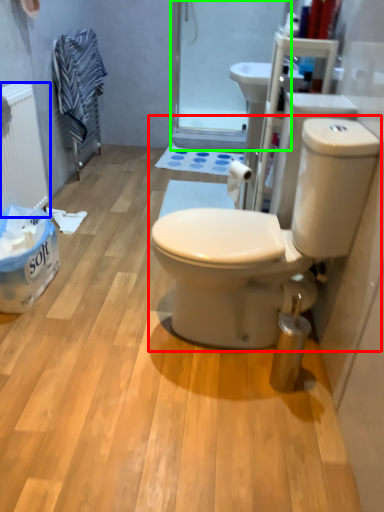
Question: Estimate the real-world distances between objects in this image. Which object is farther from toilet (highlighted by a red box), radiator (highlighted by a blue box) or screen door (highlighted by a green box)?

Choices:
 (A) radiator
 (B) screen door

Answer: (B)